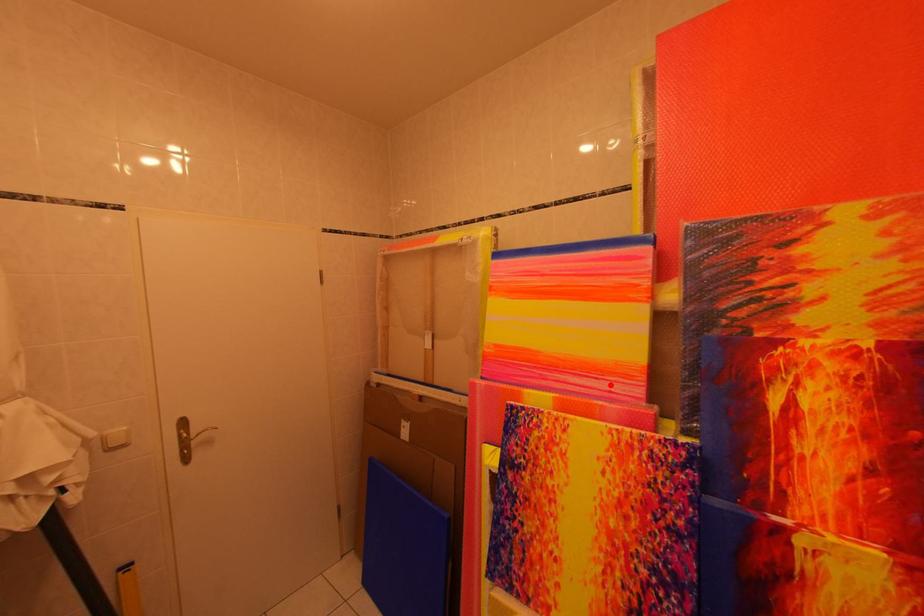
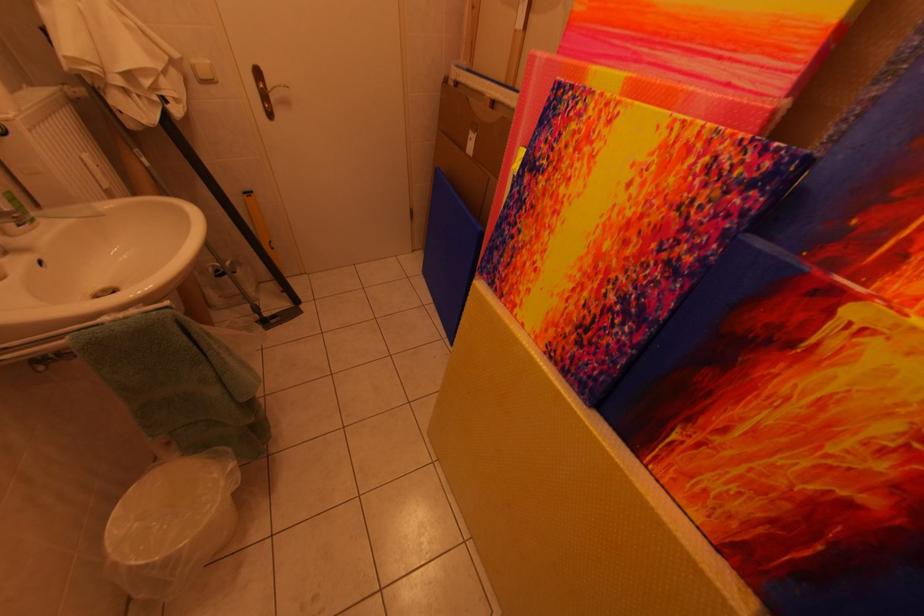
Locate, in the second image, the point that corresponds to the highlighted location in the first image.

(734, 68)